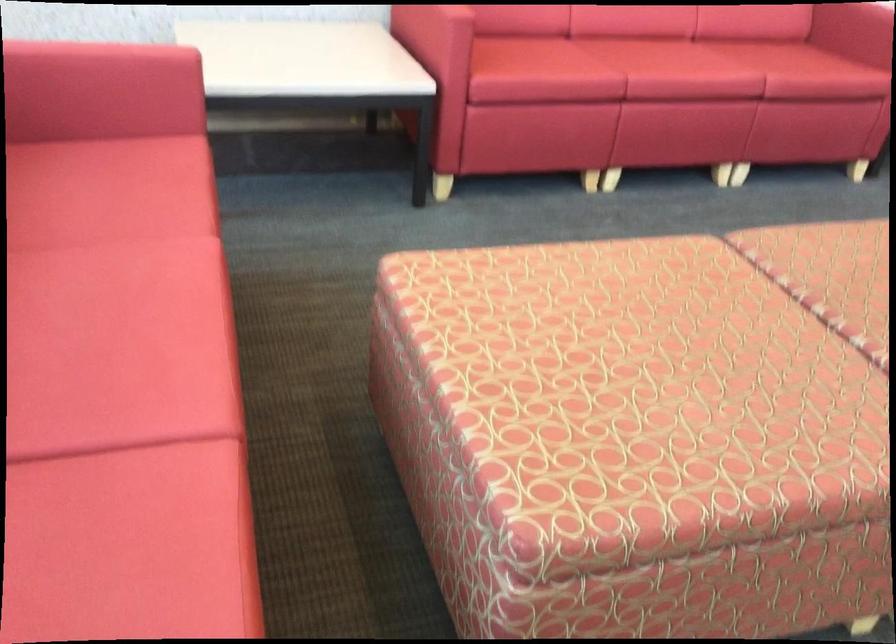
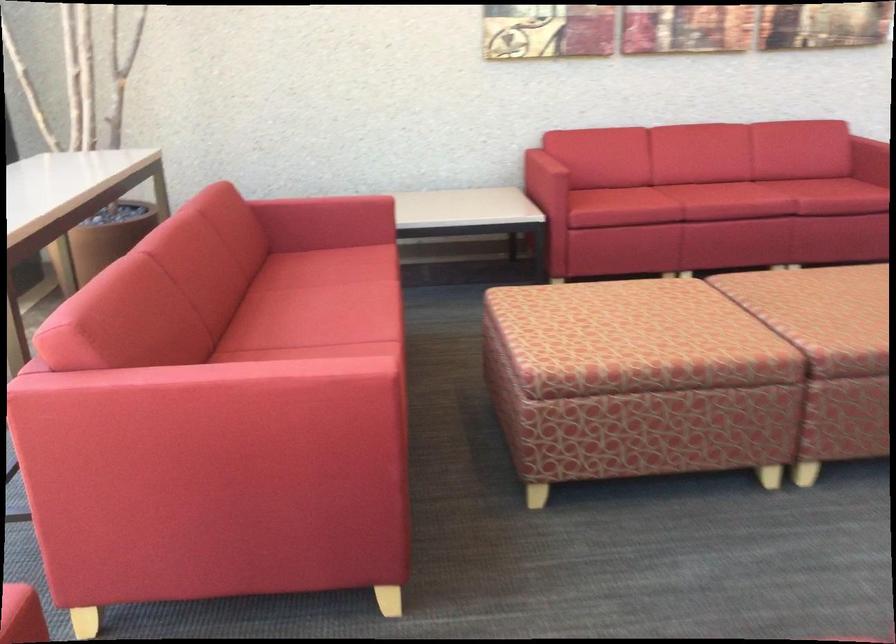
Find the pixel in the second image that matches the point at 85,281 in the first image.

(334, 295)